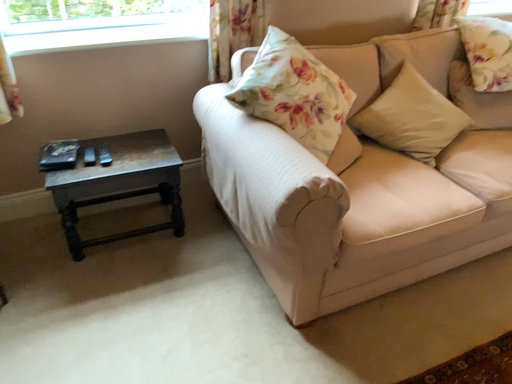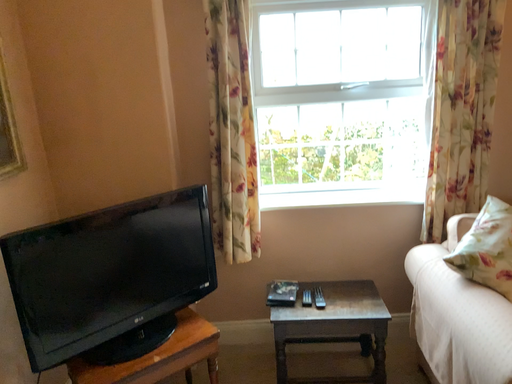
Question: Which way did the camera rotate in the video?

Choices:
 (A) rotated downward
 (B) rotated upward

Answer: (B)